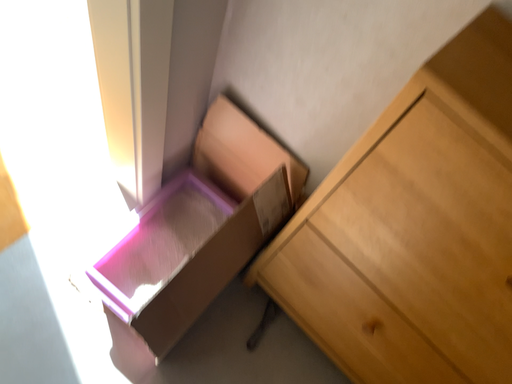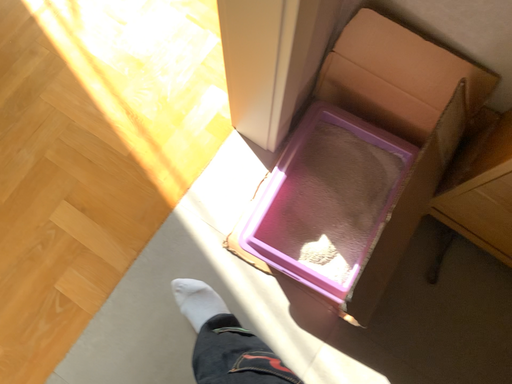
Question: Which way did the camera rotate in the video?

Choices:
 (A) rotated downward
 (B) rotated upward

Answer: (A)